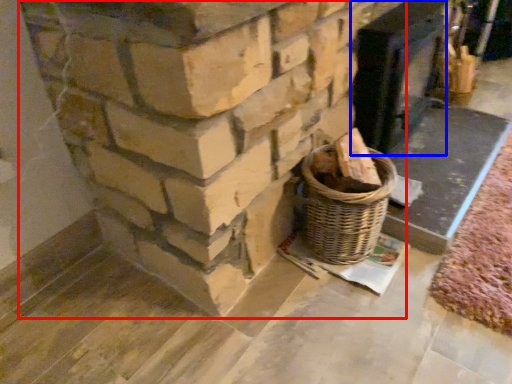
Question: Which point is further to the camera, fireplace (highlighted by a red box) or fireplace (highlighted by a blue box)?

Choices:
 (A) fireplace
 (B) fireplace

Answer: (B)